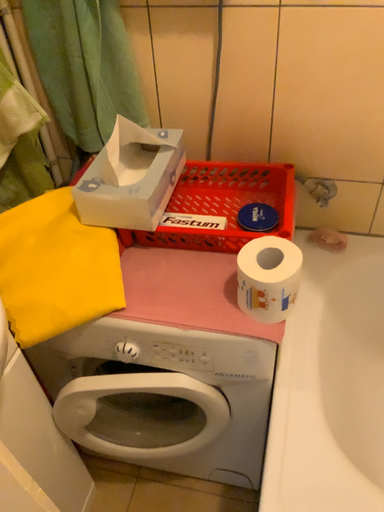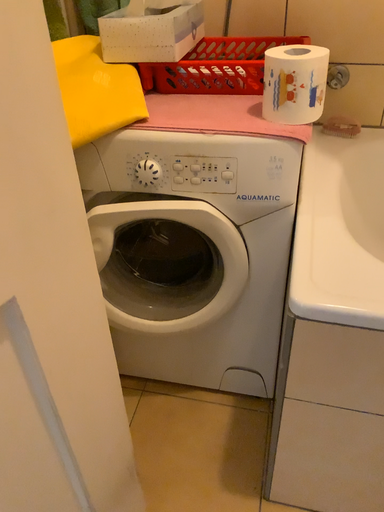
Question: How did the camera likely rotate when shooting the video?

Choices:
 (A) rotated downward
 (B) rotated upward

Answer: (B)